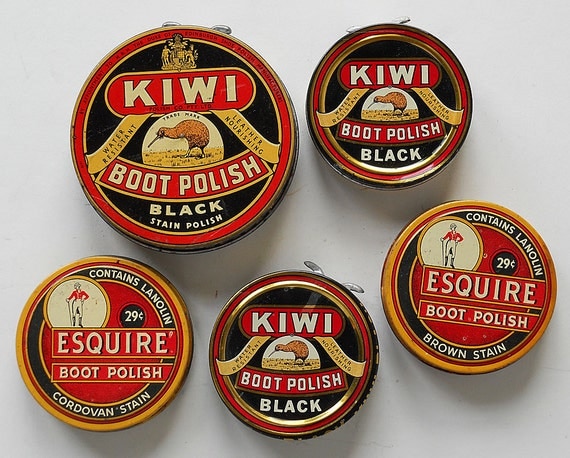
Find the location of a particular element. Image resolution: width=570 pixels, height=458 pixels. animal picture is located at coordinates (193, 128), (390, 98), (300, 350).